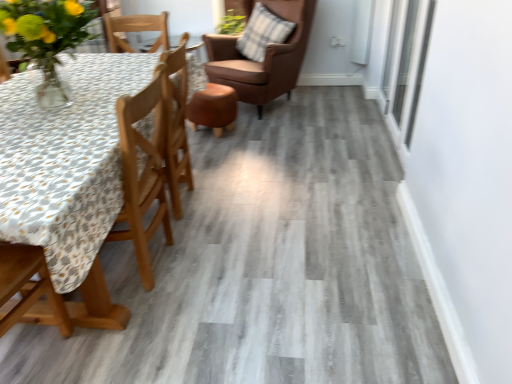
Question: Is plaid fabric pillow at upper right facing away from transparent glass window at upper right?

Choices:
 (A) yes
 (B) no

Answer: (B)

Question: Considering the relative sizes of plaid fabric pillow at upper right and transparent glass window at upper right in the image provided, is plaid fabric pillow at upper right thinner than transparent glass window at upper right?

Choices:
 (A) yes
 (B) no

Answer: (B)

Question: Does plaid fabric pillow at upper right come behind transparent glass window at upper right?

Choices:
 (A) no
 (B) yes

Answer: (B)

Question: Considering the relative sizes of plaid fabric pillow at upper right and transparent glass window at upper right in the image provided, is plaid fabric pillow at upper right taller than transparent glass window at upper right?

Choices:
 (A) no
 (B) yes

Answer: (A)

Question: Is plaid fabric pillow at upper right at the right side of transparent glass window at upper right?

Choices:
 (A) no
 (B) yes

Answer: (A)

Question: Considering the positions of brown leather chair at upper center, which is the 1th chair in right-to-left order, and plaid fabric pillow at upper right in the image, is brown leather chair at upper center, which is the 1th chair in right-to-left order, taller or shorter than plaid fabric pillow at upper right?

Choices:
 (A) tall
 (B) short

Answer: (A)

Question: Based on their positions, is brown leather chair at upper center, the second chair positioned from the bottom, located to the left or right of plaid fabric pillow at upper right?

Choices:
 (A) right
 (B) left

Answer: (B)

Question: In the image, is brown leather chair at upper center, the second chair positioned from the bottom, positioned in front of or behind plaid fabric pillow at upper right?

Choices:
 (A) behind
 (B) front

Answer: (B)

Question: From the image's perspective, is brown leather chair at upper center, which is the 1th chair in right-to-left order, located above or below plaid fabric pillow at upper right?

Choices:
 (A) below
 (B) above

Answer: (A)

Question: Looking at the image, does plaid fabric pillow at upper right seem bigger or smaller compared to brown leather chair at upper center, marked as the second chair in a left-to-right arrangement?

Choices:
 (A) small
 (B) big

Answer: (A)

Question: From the image's perspective, is plaid fabric pillow at upper right above or below brown leather chair at upper center, marked as the second chair in a left-to-right arrangement?

Choices:
 (A) above
 (B) below

Answer: (A)

Question: Is plaid fabric pillow at upper right inside the boundaries of brown leather chair at upper center, which is the 1th chair in right-to-left order, or outside?

Choices:
 (A) outside
 (B) inside

Answer: (B)

Question: In terms of width, does plaid fabric pillow at upper right look wider or thinner when compared to brown leather chair at upper center, arranged as the first chair when viewed from the back?

Choices:
 (A) wide
 (B) thin

Answer: (B)

Question: From the image's perspective, is wooden chair at left, positioned as the second chair in top-to-bottom order, above or below transparent glass window at upper right?

Choices:
 (A) above
 (B) below

Answer: (B)

Question: From a real-world perspective, is wooden chair at left, positioned as the second chair in top-to-bottom order, physically located above or below transparent glass window at upper right?

Choices:
 (A) above
 (B) below

Answer: (B)